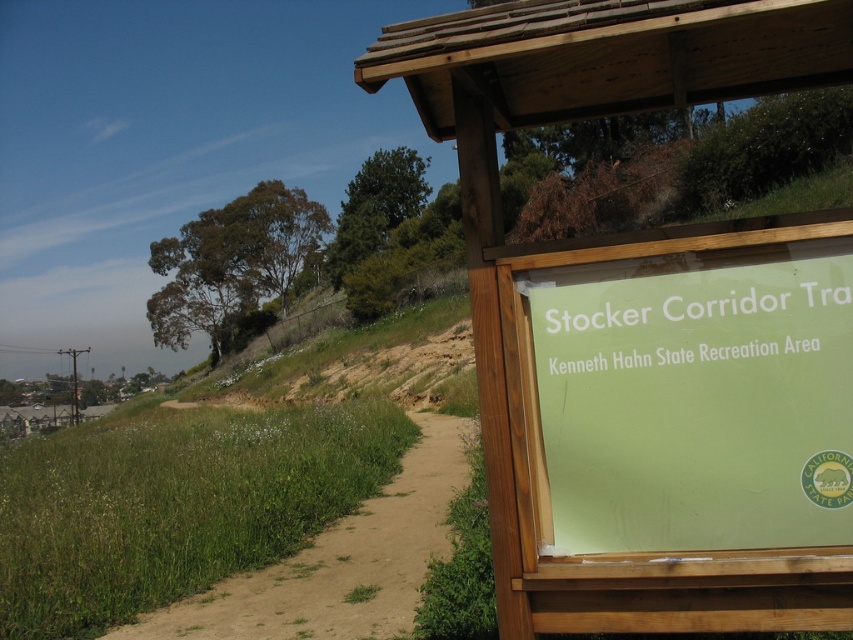
Question: Is green matte sign at right to the right of brown sandy dirt track at lower left from the viewer's perspective?

Choices:
 (A) no
 (B) yes

Answer: (B)

Question: Is wooden sign at right above green matte sign at right?

Choices:
 (A) no
 (B) yes

Answer: (B)

Question: Which point is farther from the camera taking this photo?

Choices:
 (A) click(x=815, y=268)
 (B) click(x=268, y=576)

Answer: (B)

Question: Which object is the farthest from the wooden sign at right?

Choices:
 (A) green matte sign at right
 (B) brown sandy dirt track at lower left

Answer: (B)

Question: Which point is closer to the camera taking this photo?

Choices:
 (A) (263, 634)
 (B) (705, 368)

Answer: (B)

Question: Is wooden sign at right positioned before green matte sign at right?

Choices:
 (A) yes
 (B) no

Answer: (A)